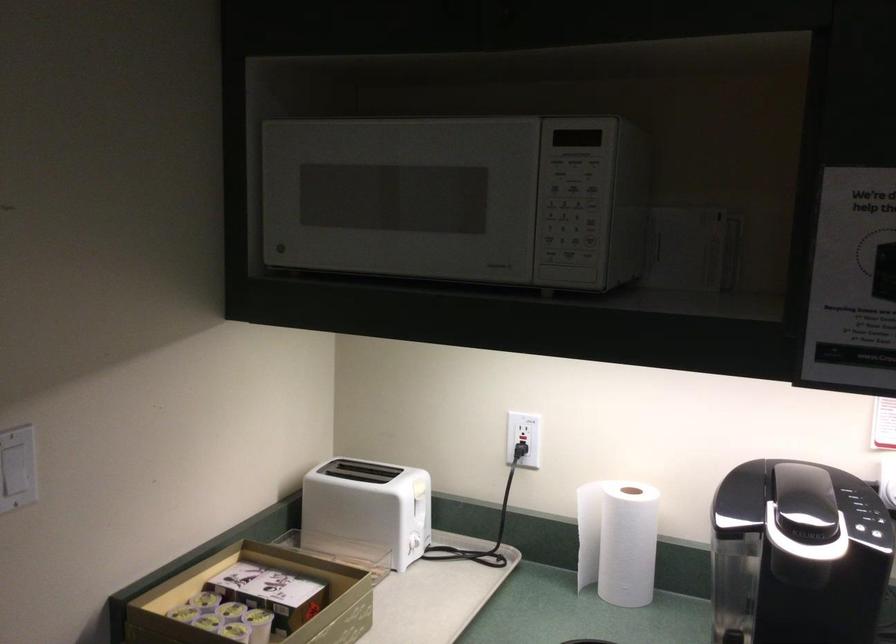
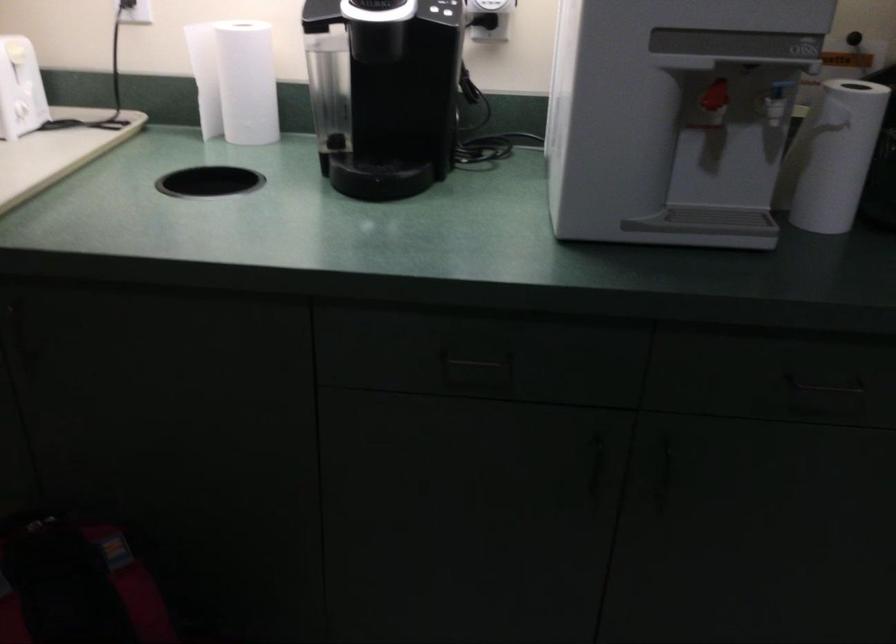
In a continuous first-person perspective shot, in which direction is the camera moving?

The movement direction of the cameraman is right, backward.